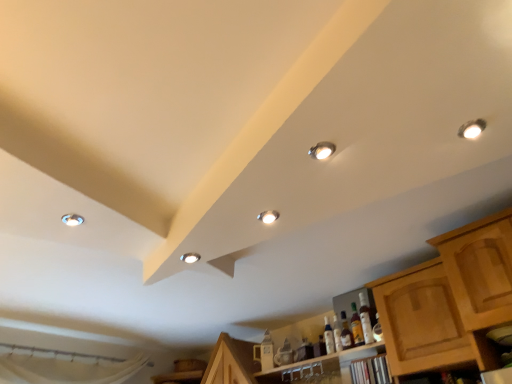
Question: Does clear glass bottle at lower center, acting as the 1th bottle starting from the left, have a smaller size compared to matte white droplight at upper left, the fourth droplight from the right?

Choices:
 (A) no
 (B) yes

Answer: (A)

Question: Is the position of clear glass bottle at lower center, acting as the 1th bottle starting from the left, more distant than that of matte white droplight at upper left, the fourth droplight from the right?

Choices:
 (A) no
 (B) yes

Answer: (B)

Question: Considering the relative sizes of clear glass bottle at lower center, the 3th bottle when ordered from right to left, and matte white droplight at upper left, the fourth droplight from the right, in the image provided, is clear glass bottle at lower center, the 3th bottle when ordered from right to left, thinner than matte white droplight at upper left, the fourth droplight from the right,?

Choices:
 (A) no
 (B) yes

Answer: (B)

Question: Are clear glass bottle at lower center, the 3th bottle when ordered from right to left, and matte white droplight at upper left, which is the 3th droplight from front to back, located far from each other?

Choices:
 (A) yes
 (B) no

Answer: (A)

Question: From the image's perspective, is clear glass bottle at lower center, acting as the 1th bottle starting from the left, located beneath matte white droplight at upper left, acting as the 2th droplight starting from the back?

Choices:
 (A) yes
 (B) no

Answer: (A)

Question: From the image's perspective, relative to matte silver droplight at center, which ranks as the second droplight in front-to-back order, is translucent amber bottle at center, which is the 2th bottle in right-to-left order, above or below?

Choices:
 (A) below
 (B) above

Answer: (A)

Question: Would you say translucent amber bottle at center, which is the 2th bottle in right-to-left order, is inside or outside matte silver droplight at center, which ranks as the second droplight in front-to-back order?

Choices:
 (A) inside
 (B) outside

Answer: (B)

Question: From a real-world perspective, relative to matte silver droplight at center, marked as the third droplight in a bottom-to-top arrangement, is translucent amber bottle at center, the 2th bottle positioned from the left, vertically above or below?

Choices:
 (A) below
 (B) above

Answer: (A)

Question: Is translucent amber bottle at center, which is the 2th bottle in right-to-left order, wider or thinner than matte silver droplight at center, marked as the third droplight in a bottom-to-top arrangement?

Choices:
 (A) wide
 (B) thin

Answer: (B)

Question: Is matte white droplight at upper left, the second droplight ordered from the bottom, wider or thinner than matte silver droplight at upper right, marked as the 1th droplight in a top-to-bottom arrangement?

Choices:
 (A) thin
 (B) wide

Answer: (A)

Question: From the image's perspective, relative to matte silver droplight at upper right, which is the fourth droplight in bottom-to-top order, is matte white droplight at upper left, the first droplight from the left, above or below?

Choices:
 (A) above
 (B) below

Answer: (B)

Question: In the image, is matte white droplight at upper left, the fourth droplight from the right, positioned in front of or behind matte silver droplight at upper right, marked as the 1th droplight in a top-to-bottom arrangement?

Choices:
 (A) front
 (B) behind

Answer: (B)

Question: Visually, is matte white droplight at upper left, the second droplight ordered from the bottom, positioned to the left or to the right of matte silver droplight at upper right, marked as the 1th droplight in a top-to-bottom arrangement?

Choices:
 (A) right
 (B) left

Answer: (B)

Question: From the image's perspective, is matte white droplight at upper left, acting as the 2th droplight starting from the back, located above or below wooden cabinet at lower right?

Choices:
 (A) above
 (B) below

Answer: (A)

Question: Is point (62, 221) positioned closer to the camera than point (486, 309)?

Choices:
 (A) closer
 (B) farther

Answer: (A)